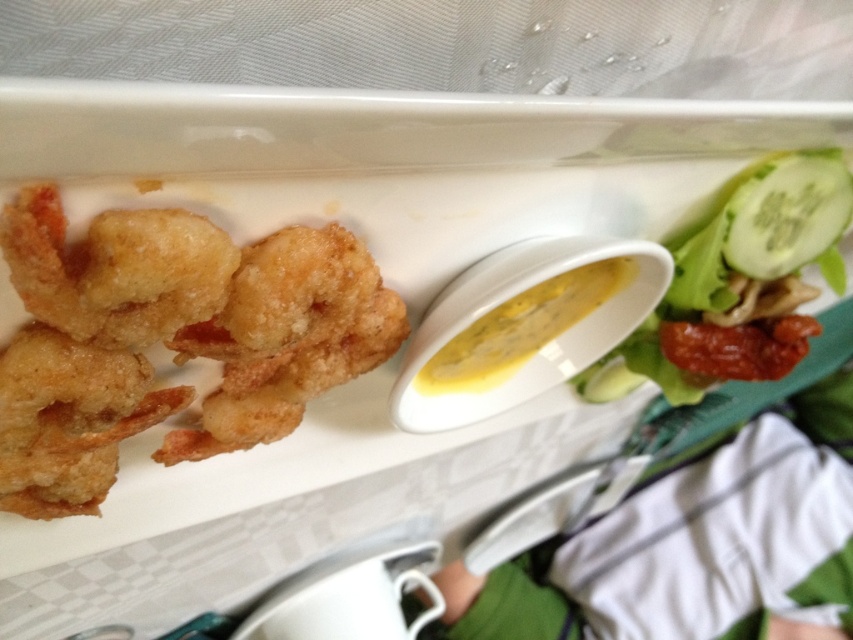
Question: Which point appears closest to the camera in this image?

Choices:
 (A) (828, 278)
 (B) (21, 390)

Answer: (B)

Question: Considering the relative positions of golden crispy shrimp at upper left and green leafy salad at upper right in the image provided, where is golden crispy shrimp at upper left located with respect to green leafy salad at upper right?

Choices:
 (A) below
 (B) above

Answer: (A)

Question: In this image, where is golden crispy shrimp at upper left located relative to green leafy salad at upper right?

Choices:
 (A) above
 (B) below

Answer: (B)

Question: Can you confirm if golden crispy shrimp at upper left is smaller than green leafy salad at upper right?

Choices:
 (A) no
 (B) yes

Answer: (B)